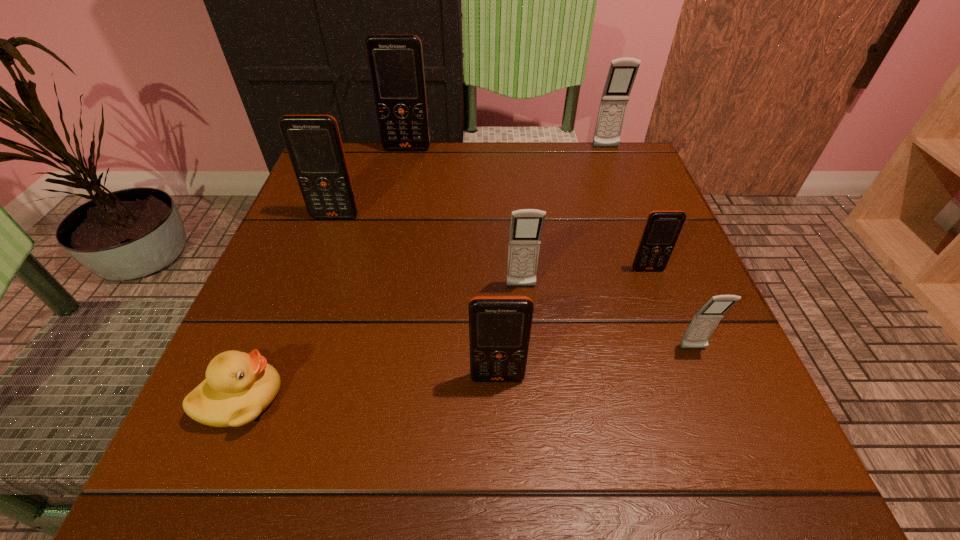
Locate an element on the screen. The width and height of the screenshot is (960, 540). the second nearest orange cellular telephone is located at coordinates (662, 228).

Locate an element on the screen. This screenshot has height=540, width=960. the smallest gray cellular telephone is located at coordinates (703, 324).

Find the location of a particular element. This screenshot has width=960, height=540. the sixth farthest object is located at coordinates (703, 324).

Identify the location of the shortest object. (238, 387).

The image size is (960, 540). Identify the location of duckling. (238, 387).

What are the coordinates of `vacant space located on the screen of the second orange cellular telephone from left to right` in the screenshot? It's located at (396, 199).

What are the coordinates of `free spot located 0.400m on the front-facing side of the farthest gray cellular telephone` in the screenshot? It's located at (649, 259).

Find the location of a particular element. free region located 0.050m on the screen of the leftmost cellular telephone is located at coordinates (328, 236).

What are the coordinates of `vacant space located on the front-facing side of the leftmost gray cellular telephone` in the screenshot? It's located at (526, 342).

What are the coordinates of `free spot located 0.100m on the screen of the nearest orange cellular telephone` in the screenshot? It's located at (500, 451).